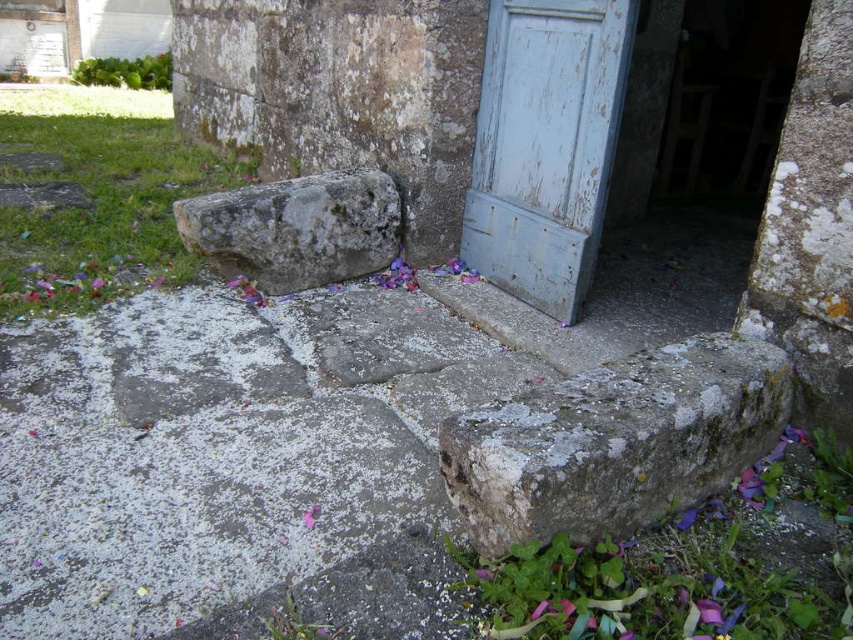
You are a painter who wants to paint a mural on the blue weathered wood door at center right and the pink paper flower at center. Which object requires more paint due to its size?

The blue weathered wood door at center right requires more paint because it has a larger size compared to the pink paper flower at center.